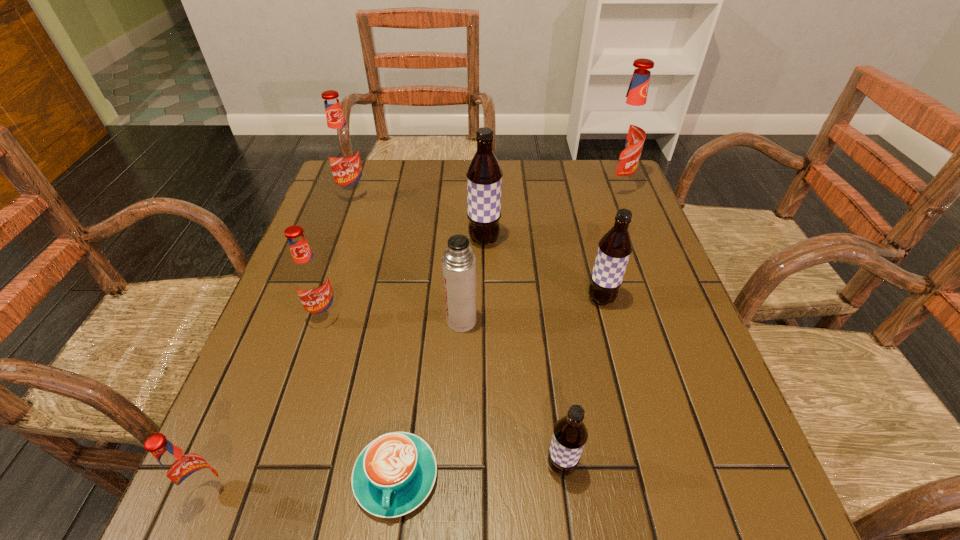
You are a GUI agent. You are given a task and a screenshot of the screen. Output one action in this format:
    pyautogui.click(x=<x>, y=<y>)
    Task: Click on the root beer that stands as the second closest to the fifth root beer from left to right
    This screenshot has height=540, width=960.
    Given the screenshot: What is the action you would take?
    pyautogui.click(x=311, y=280)

Select which red root beer appears as the second closest to the second smallest red root beer. Please provide its 2D coordinates. Your answer should be formatted as a tuple, i.e. [(x, y)], where the tuple contains the x and y coordinates of a point satisfying the conditions above.

[(342, 149)]

Choose which red root beer is the nearest neighbor to the thermos bottle. Please provide its 2D coordinates. Your answer should be formatted as a tuple, i.e. [(x, y)], where the tuple contains the x and y coordinates of a point satisfying the conditions above.

[(311, 280)]

Locate an element on the screen. The image size is (960, 540). brown root beer that can be found as the second closest to the nearest brown root beer is located at coordinates (484, 175).

Select which brown root beer is the second closest to the second nearest red root beer. Please provide its 2D coordinates. Your answer should be formatted as a tuple, i.e. [(x, y)], where the tuple contains the x and y coordinates of a point satisfying the conditions above.

[(570, 434)]

Image resolution: width=960 pixels, height=540 pixels. In order to click on vacant space that satisfies the following two spatial constraints: 1. on the back side of the smallest red root beer; 2. on the right side of the thermos bottle in this screenshot , I will do `click(281, 321)`.

This screenshot has width=960, height=540. What are the coordinates of `vacant space that satisfies the following two spatial constraints: 1. on the front side of the thermos bottle; 2. on the left side of the second brown root beer from left to right` in the screenshot? It's located at tap(456, 466).

I want to click on vacant space that satisfies the following two spatial constraints: 1. on the back side of the fifth nearest root beer; 2. on the left side of the rightmost root beer, so [x=484, y=188].